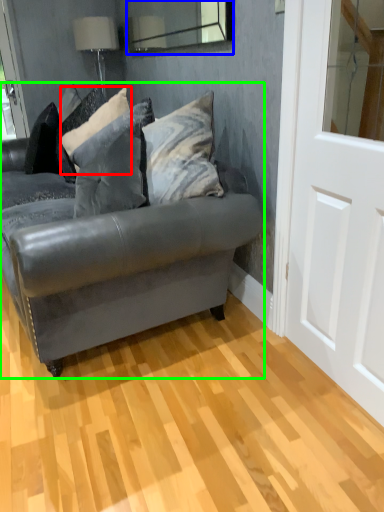
Question: Which object is positioned closest to pillow (highlighted by a red box)? Select from mirror (highlighted by a blue box) and studio couch (highlighted by a green box).

Choices:
 (A) mirror
 (B) studio couch

Answer: (B)